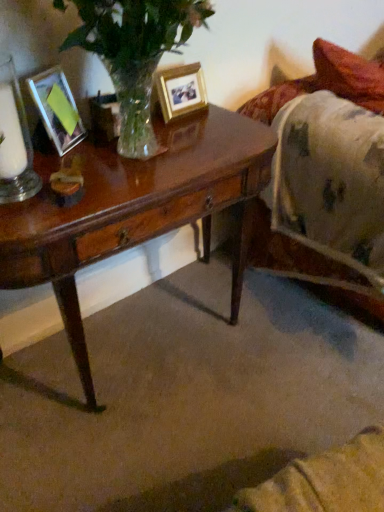
Question: Is fluffy white blanket at right thinner than clear glass candle holder at left?

Choices:
 (A) yes
 (B) no

Answer: (B)

Question: Can you confirm if fluffy white blanket at right is smaller than clear glass candle holder at left?

Choices:
 (A) no
 (B) yes

Answer: (A)

Question: Is fluffy white blanket at right facing towards clear glass candle holder at left?

Choices:
 (A) yes
 (B) no

Answer: (B)

Question: Is fluffy white blanket at right placed right next to clear glass candle holder at left?

Choices:
 (A) yes
 (B) no

Answer: (B)

Question: Is fluffy white blanket at right closer to camera compared to clear glass candle holder at left?

Choices:
 (A) no
 (B) yes

Answer: (A)

Question: Considering the positions of gold metallic photo frame at upper center, which ranks as the 2th picture frame in left-to-right order, and white wax candle at left in the image, is gold metallic photo frame at upper center, which ranks as the 2th picture frame in left-to-right order, wider or thinner than white wax candle at left?

Choices:
 (A) wide
 (B) thin

Answer: (B)

Question: From the image's perspective, relative to white wax candle at left, is gold metallic photo frame at upper center, which ranks as the 2th picture frame in front-to-back order, above or below?

Choices:
 (A) above
 (B) below

Answer: (A)

Question: In terms of height, does gold metallic photo frame at upper center, which ranks as the 2th picture frame in left-to-right order, look taller or shorter compared to white wax candle at left?

Choices:
 (A) tall
 (B) short

Answer: (B)

Question: Relative to white wax candle at left, is gold metallic photo frame at upper center, which ranks as the 2th picture frame in front-to-back order, in front or behind?

Choices:
 (A) front
 (B) behind

Answer: (B)

Question: From the image's perspective, is gold metallic photo frame at upper center, positioned as the first picture frame in back-to-front order, located above or below clear glass candle holder at left?

Choices:
 (A) below
 (B) above

Answer: (B)

Question: Is point (170, 116) closer or farther from the camera than point (24, 190)?

Choices:
 (A) farther
 (B) closer

Answer: (A)

Question: From a real-world perspective, relative to clear glass candle holder at left, is gold metallic photo frame at upper center, positioned as the first picture frame in back-to-front order, vertically above or below?

Choices:
 (A) below
 (B) above

Answer: (A)

Question: Is gold metallic photo frame at upper center, positioned as the first picture frame in back-to-front order, wider or thinner than clear glass candle holder at left?

Choices:
 (A) thin
 (B) wide

Answer: (A)

Question: From a real-world perspective, is matte glass picture frame at left, marked as the first picture frame in a front-to-back arrangement, positioned above or below clear glass candle holder at left?

Choices:
 (A) above
 (B) below

Answer: (B)

Question: Relative to clear glass candle holder at left, is matte glass picture frame at left, which is the first picture frame in left-to-right order, in front or behind?

Choices:
 (A) front
 (B) behind

Answer: (B)